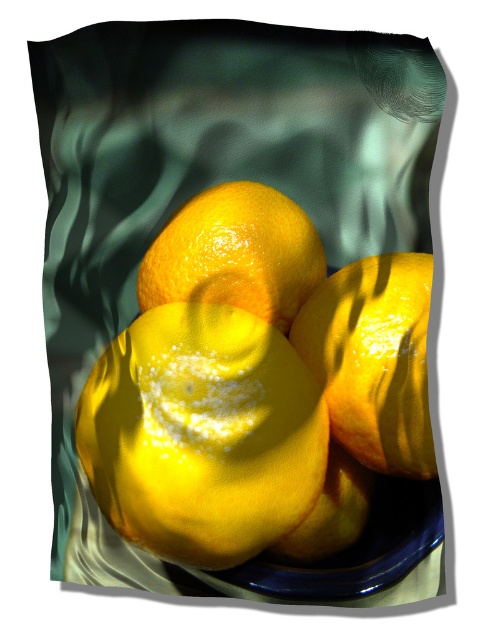
You are arranging fruits on a table and want to place a new fruit between the glossy citrus fruit at center and the glossy yellow tangerine at center. Based on their positions, which fruit should be on the left side of the new fruit?

The glossy yellow tangerine at center should be on the left side of the new fruit because the glossy citrus fruit at center is to the right of the glossy yellow tangerine at center.

You are arranging lemons on a dark table for a photo shoot. You have a glossy yellow lemon at center and a glossy citrus fruit at center. According to the scene description, which lemon is positioned lower?

The glossy yellow lemon at center is positioned lower than the glossy citrus fruit at center.